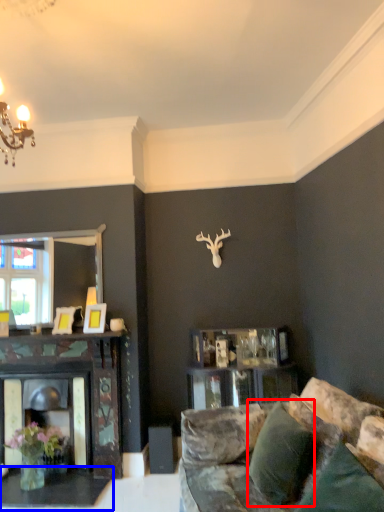
Question: Among these objects, which one is farthest to the camera, pillow (highlighted by a red box) or table (highlighted by a blue box)?

Choices:
 (A) pillow
 (B) table

Answer: (B)